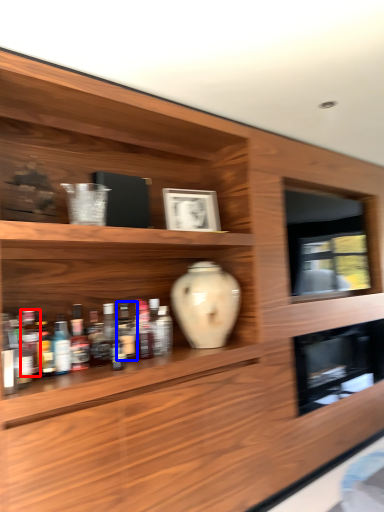
Question: Which of the following is the closest to the observer, bottle (highlighted by a red box) or bottle (highlighted by a blue box)?

Choices:
 (A) bottle
 (B) bottle

Answer: (A)